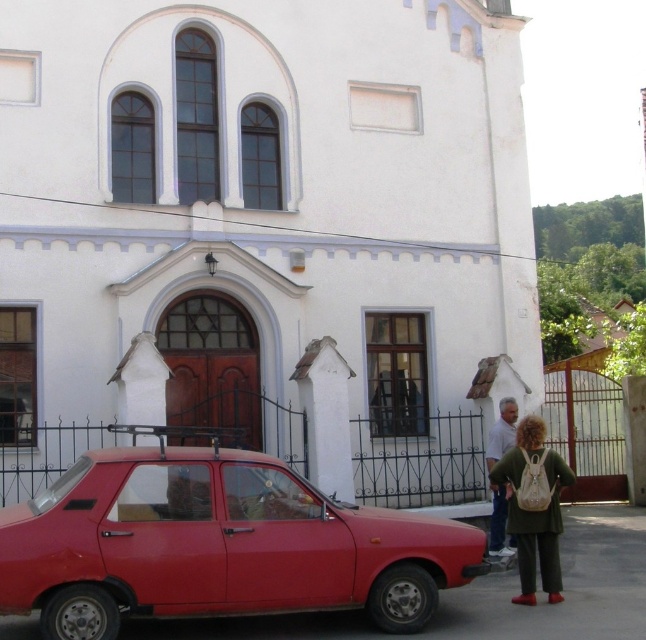
You are standing in front of the white building and notice two green items at the lower right corner of the image. Which one is nearer to you, the green fabric backpack at lower right or the green fabric jacket at lower right?

The green fabric backpack at lower right is closer to the viewer than the green fabric jacket at lower right.

You are a photographer standing at the entrance of the white smooth church at center. You want to take a photo that includes both the church and the green fabric jacket at lower right. Since you have a wide angle lens, you can capture a large area. However, you need to ensure that the church is not too small in the frame compared to the jacket. Based on their sizes, will the church appear larger than the jacket in the photo?

The white smooth church at center is wider than the green fabric jacket at lower right, so in the photo taken with a wide angle lens from the entrance, the church will appear larger than the jacket.